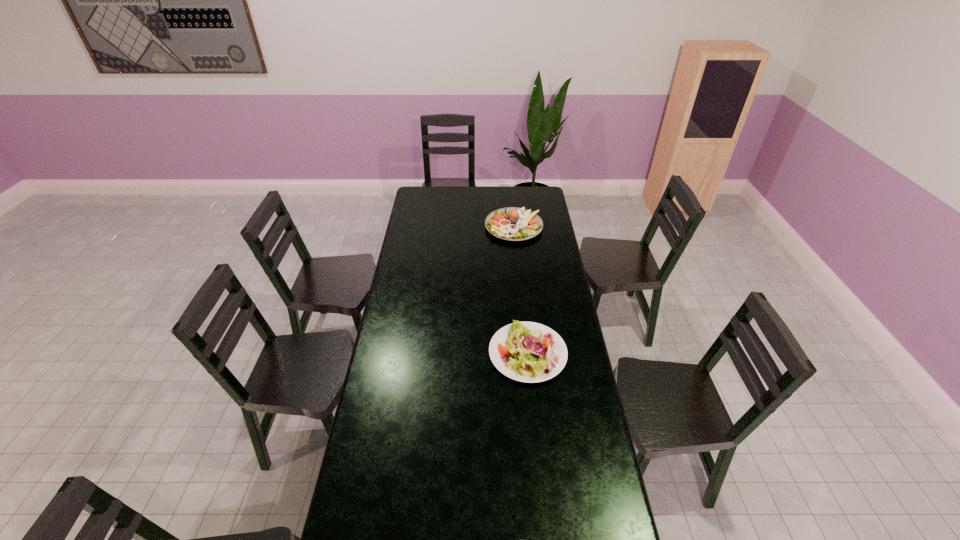
This screenshot has height=540, width=960. In order to click on the farthest object in this screenshot , I will do `click(511, 223)`.

This screenshot has height=540, width=960. Identify the location of the taller salad plate. (511, 223).

This screenshot has width=960, height=540. What are the coordinates of `the second shortest object` in the screenshot? It's located at (530, 352).

Locate an element on the screen. This screenshot has width=960, height=540. the second nearest object is located at coordinates (530, 352).

In order to click on vacant space located 0.060m on the back of the taller salad plate in this screenshot , I will do `click(512, 206)`.

The width and height of the screenshot is (960, 540). What are the coordinates of `vacant space situated 0.090m on the left of the shorter salad plate` in the screenshot? It's located at (468, 353).

What are the coordinates of `free location at the far edge` in the screenshot? It's located at coord(495,205).

Where is `blank space at the left edge of the desktop`? The width and height of the screenshot is (960, 540). blank space at the left edge of the desktop is located at coordinates (422, 221).

Identify the location of vacant space at the right edge of the desktop. (537, 299).

This screenshot has height=540, width=960. What are the coordinates of `free space between the farther salad plate and the shorter salad plate` in the screenshot? It's located at click(x=520, y=290).